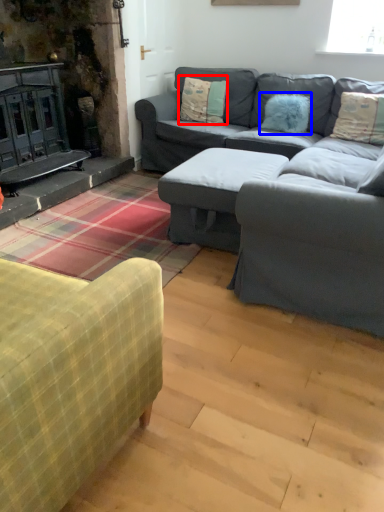
Question: Which object appears farthest to the camera in this image, pillow (highlighted by a red box) or pillow (highlighted by a blue box)?

Choices:
 (A) pillow
 (B) pillow

Answer: (A)